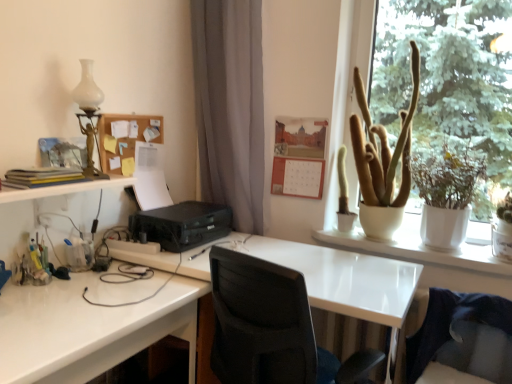
Image resolution: width=512 pixels, height=384 pixels. What do you see at coordinates (41, 177) in the screenshot?
I see `matte yellow book at left` at bounding box center [41, 177].

Find the location of a particular element. black mesh swivel chair at lower right is located at coordinates (449, 324).

This screenshot has height=384, width=512. What do you see at coordinates (424, 248) in the screenshot?
I see `white ceramic pot at upper right` at bounding box center [424, 248].

This screenshot has width=512, height=384. What do you see at coordinates (89, 116) in the screenshot?
I see `white glass table lamp at upper left` at bounding box center [89, 116].

Describe the element at coordinates (90, 325) in the screenshot. I see `white glossy desk at lower left, the second desk in the right-to-left sequence` at that location.

The height and width of the screenshot is (384, 512). What are the coordinates of `black plastic printer at center` in the screenshot? It's located at (182, 224).

Locate an element on the screen. The width and height of the screenshot is (512, 384). table lamp behind the white glossy desk at center, placed as the first desk when sorted from right to left is located at coordinates (89, 116).

Is white glass table lamp at upper left shorter than white glossy desk at center, placed as the first desk when sorted from right to left?

Indeed, white glass table lamp at upper left has a lesser height compared to white glossy desk at center, placed as the first desk when sorted from right to left.

From the image's perspective, is white glass table lamp at upper left below white glossy desk at center, positioned as the second desk in left-to-right order?

Incorrect, from the image's perspective, white glass table lamp at upper left is higher than white glossy desk at center, positioned as the second desk in left-to-right order.

In the scene shown: From a real-world perspective, is white glass table lamp at upper left on white glossy desk at center, positioned as the second desk in left-to-right order?

Yes, from a real-world perspective, white glass table lamp at upper left is on top of white glossy desk at center, positioned as the second desk in left-to-right order.

What's the angular difference between white ceramic pot at upper right and white glossy table at upper right's facing directions?

They differ by 0.0802 degrees in their facing directions.

Is white ceramic pot at upper right taller or shorter than white glossy table at upper right?

white ceramic pot at upper right is taller than white glossy table at upper right.

Does white ceramic pot at upper right have a lesser width compared to white glossy table at upper right?

Indeed, white ceramic pot at upper right has a lesser width compared to white glossy table at upper right.

From a real-world perspective, between white ceramic pot at upper right and white glossy table at upper right, who is vertically lower?

In real-world perspective, white glossy table at upper right is lower.

How different are the orientations of black plastic printer at center and white glass table lamp at upper left in degrees?

black plastic printer at center and white glass table lamp at upper left are facing 1.71 degrees away from each other.

Between black plastic printer at center and white glass table lamp at upper left, which one appears on the left side from the viewer's perspective?

From the viewer's perspective, white glass table lamp at upper left appears more on the left side.

Choose the correct answer: Is black plastic printer at center inside white glass table lamp at upper left or outside it?

black plastic printer at center is outside white glass table lamp at upper left.

Consider the image. Would you consider black plastic printer at center to be distant from white glass table lamp at upper left?

No, black plastic printer at center is in close proximity to white glass table lamp at upper left.

From the image's perspective, is white glossy table at upper right on white glossy desk at center, placed as the first desk when sorted from right to left?

Yes, from the image's perspective, white glossy table at upper right is above white glossy desk at center, placed as the first desk when sorted from right to left.

From a real-world perspective, which is physically below, white glossy table at upper right or white glossy desk at center, placed as the first desk when sorted from right to left?

From a 3D spatial view, white glossy desk at center, placed as the first desk when sorted from right to left, is below.

Which is more to the left, white glossy table at upper right or white glossy desk at center, positioned as the second desk in left-to-right order?

From the viewer's perspective, white glossy desk at center, positioned as the second desk in left-to-right order, appears more on the left side.

At what (x,y) coordinates should I click in order to perform the action: click on table located on the right of white glossy desk at center, placed as the first desk when sorted from right to left. Please return your answer as a coordinate pair (x, y). The image size is (512, 384). Looking at the image, I should click on (431, 259).

Is green matte plant at upper right completely or partially inside white glossy desk at lower left, the second desk in the right-to-left sequence?

No.

Consider the image. Is white glossy desk at lower left, the second desk in the right-to-left sequence, facing towards green matte plant at upper right?

No, white glossy desk at lower left, the second desk in the right-to-left sequence, is not facing towards green matte plant at upper right.

What's the angular difference between white glossy desk at lower left, the second desk in the right-to-left sequence, and green matte plant at upper right's facing directions?

91.2 degrees separate the facing orientations of white glossy desk at lower left, the second desk in the right-to-left sequence, and green matte plant at upper right.

Is point (57, 284) closer to camera compared to point (455, 179)?

Yes, point (57, 284) is closer to viewer.

Is white glossy desk at lower left, the second desk in the right-to-left sequence, smaller than matte yellow book at left?

Incorrect, white glossy desk at lower left, the second desk in the right-to-left sequence, is not smaller in size than matte yellow book at left.

Is white glossy desk at lower left, which is the first desk from left to right, to the left or to the right of matte yellow book at left in the image?

Clearly, white glossy desk at lower left, which is the first desk from left to right, is on the right of matte yellow book at left in the image.

Which is in front, white glossy desk at lower left, which is the first desk from left to right, or matte yellow book at left?

white glossy desk at lower left, which is the first desk from left to right, is closer to the camera.

Would you say matte yellow book at left is part of white glossy desk at lower left, which is the first desk from left to right,'s contents?

Actually, matte yellow book at left is outside white glossy desk at lower left, which is the first desk from left to right.

Is corkboard at upper left, the 1th bulletin board viewed from the left, wider than white ceramic pot at upper right?

Incorrect, the width of corkboard at upper left, the 1th bulletin board viewed from the left, does not surpass that of white ceramic pot at upper right.

Which is behind, corkboard at upper left, the 1th bulletin board viewed from the left, or white ceramic pot at upper right?

corkboard at upper left, the 1th bulletin board viewed from the left, is further from the camera.

Are corkboard at upper left, the 1th bulletin board viewed from the left, and white ceramic pot at upper right far apart?

Indeed, corkboard at upper left, the 1th bulletin board viewed from the left, is not near white ceramic pot at upper right.

Is corkboard at upper left, the 1th bulletin board viewed from the left, aimed at white ceramic pot at upper right?

Yes, corkboard at upper left, the 1th bulletin board viewed from the left, is aimed at white ceramic pot at upper right.

From a real-world perspective, count 2nd desks downward from the white glass table lamp at upper left and point to it. Please provide its 2D coordinates.

[(89, 326)]

Identify the location of window above the white glossy table at upper right (from a real-world perspective). The height and width of the screenshot is (384, 512). (424, 248).

Estimate the real-world distances between objects in this image. Which object is closer to white glossy desk at center, positioned as the second desk in left-to-right order, white ceramic pot at upper right or white glossy table at upper right?

Based on the image, white glossy table at upper right appears to be nearer to white glossy desk at center, positioned as the second desk in left-to-right order.

From the picture: Estimate the real-world distances between objects in this image. Which object is further from white glass table lamp at upper left, black plastic printer at center or orange matte calendar at upper center, arranged as the second bulletin board when viewed from the left?

The object further to white glass table lamp at upper left is orange matte calendar at upper center, arranged as the second bulletin board when viewed from the left.

Which object lies further to the anchor point black plastic printer at center, matte yellow book at left or orange matte calendar at upper center, arranged as the second bulletin board when viewed from the left?

matte yellow book at left lies further to black plastic printer at center than the other object.

Which object lies nearer to the anchor point green matte plant at upper right, white glass table lamp at upper left or white glossy table at upper right?

white glossy table at upper right is closer to green matte plant at upper right.

From the image, which object appears to be nearer to black plastic printer at center, green matte plant at upper right or corkboard at upper left, the 1th bulletin board viewed from the left?

corkboard at upper left, the 1th bulletin board viewed from the left, is closer to black plastic printer at center.

Which object lies further to the anchor point matte yellow book at left, white glossy desk at lower left, which is the first desk from left to right, or orange matte calendar at upper center, arranged as the 1th bulletin board when viewed from the right?

orange matte calendar at upper center, arranged as the 1th bulletin board when viewed from the right, is positioned further to the anchor matte yellow book at left.

Estimate the real-world distances between objects in this image. Which object is further from black mesh swivel chair at lower right, green matte plant at upper right or corkboard at upper left, the 1th bulletin board viewed from the left?

The object further to black mesh swivel chair at lower right is corkboard at upper left, the 1th bulletin board viewed from the left.

From the image, which object appears to be nearer to white glossy table at upper right, white glossy desk at center, placed as the first desk when sorted from right to left, or white ceramic pot at upper right?

Among the two, white ceramic pot at upper right is located nearer to white glossy table at upper right.

Image resolution: width=512 pixels, height=384 pixels. Identify the location of houseplant that lies between white ceramic pot at upper right and white glossy desk at center, positioned as the second desk in left-to-right order, from top to bottom. (446, 195).

You are a GUI agent. You are given a task and a screenshot of the screen. Output one action in this format:
    pyautogui.click(x=<x>, y=<y>)
    Task: Click on the book between corkboard at upper left, which is the second bulletin board in right-to-left order, and white glossy desk at lower left, which is the first desk from left to right, vertically
    Image resolution: width=512 pixels, height=384 pixels.
    Given the screenshot: What is the action you would take?
    pyautogui.click(x=41, y=177)

The image size is (512, 384). I want to click on printer located between corkboard at upper left, the 1th bulletin board viewed from the left, and white glossy table at upper right in the left-right direction, so click(x=182, y=224).

Where is `desk located between black plastic printer at center and white glossy table at upper right in the left-right direction`? desk located between black plastic printer at center and white glossy table at upper right in the left-right direction is located at coordinates (89, 326).